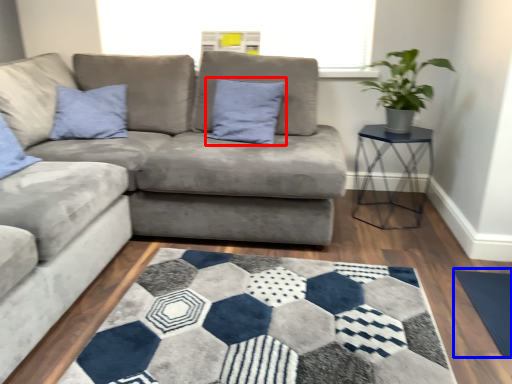
Question: Which point is further to the camera, pillow (highlighted by a red box) or yoga mat (highlighted by a blue box)?

Choices:
 (A) pillow
 (B) yoga mat

Answer: (A)